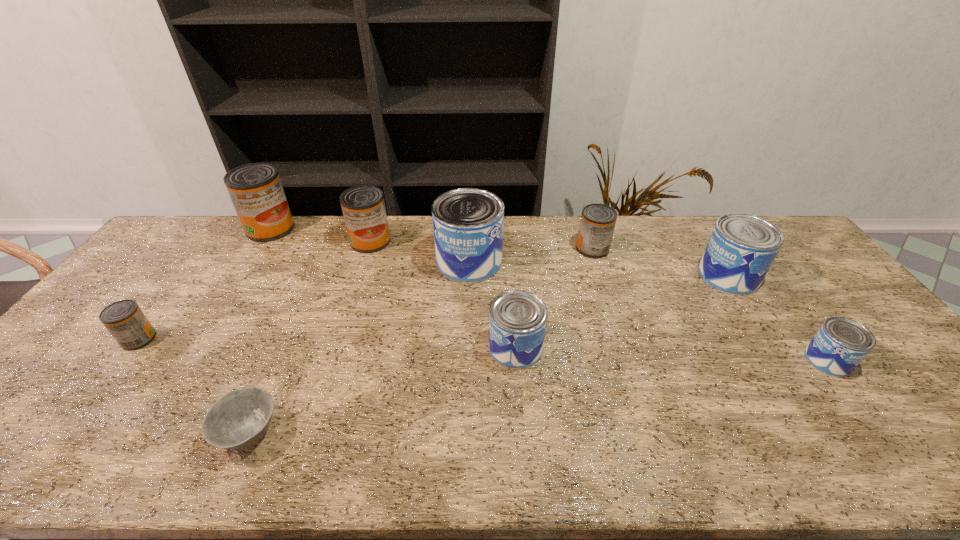
At what (x,y) coordinates should I click in order to perform the action: click on the third closest blue can relative to the biggest blue can. Please return your answer as a coordinate pair (x, y). Looking at the image, I should click on (838, 347).

Locate an element on the screen. This screenshot has height=540, width=960. blue can that is the second closest to the smallest blue can is located at coordinates pyautogui.click(x=517, y=318).

Image resolution: width=960 pixels, height=540 pixels. I want to click on free point that satisfies the following two spatial constraints: 1. on the back side of the third red can from right to left; 2. on the left side of the smallest red can, so click(223, 228).

The image size is (960, 540). I want to click on free space that satisfies the following two spatial constraints: 1. on the front side of the second red can from right to left; 2. on the right side of the sixth can from left to right, so click(x=368, y=249).

The height and width of the screenshot is (540, 960). Find the location of `free spot that satisfies the following two spatial constraints: 1. on the back side of the second biggest red can; 2. on the right side of the bowl`. free spot that satisfies the following two spatial constraints: 1. on the back side of the second biggest red can; 2. on the right side of the bowl is located at coordinates (331, 241).

This screenshot has height=540, width=960. In order to click on vacant position in the image that satisfies the following two spatial constraints: 1. on the front label of the biggest blue can; 2. on the front side of the leftmost red can in this screenshot , I will do `click(467, 339)`.